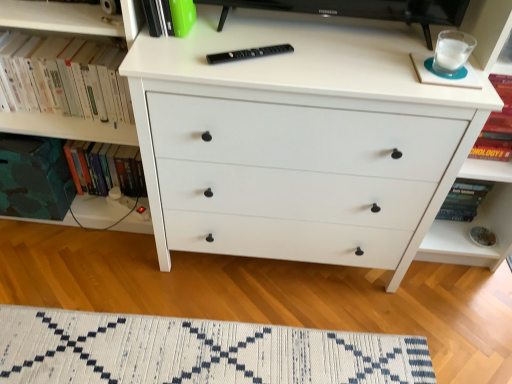
In order to click on vacant space in front of green matte book at upper center, which is counted as the first book, starting from the front in this screenshot , I will do `click(173, 59)`.